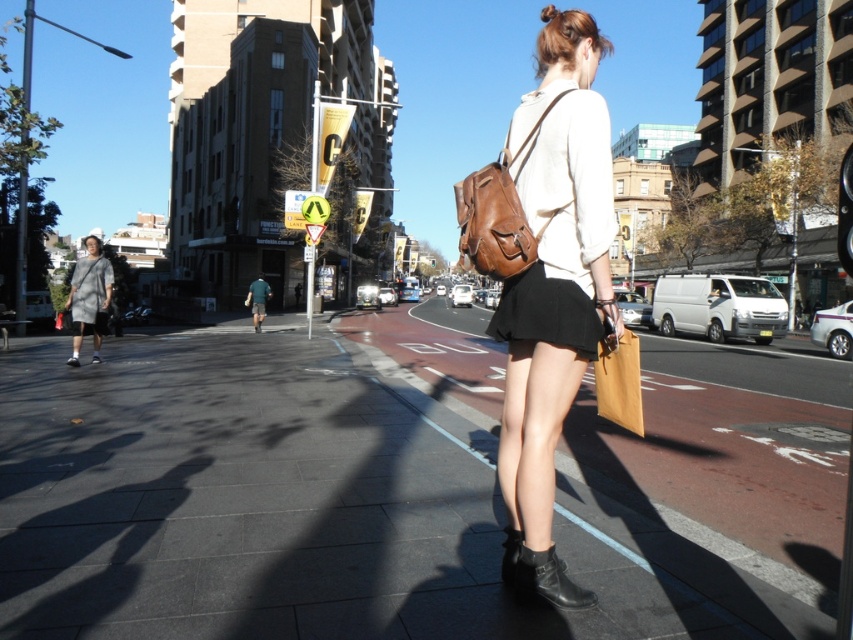
Is point (497, 512) farther from camera compared to point (561, 92)?

Yes, it is.

Is smooth concrete pavement at center to the right of brown leather backpack at upper center from the viewer's perspective?

No, smooth concrete pavement at center is not to the right of brown leather backpack at upper center.

Does point (367, 410) come in front of point (505, 177)?

No, (367, 410) is behind (505, 177).

You are a GUI agent. You are given a task and a screenshot of the screen. Output one action in this format:
    pyautogui.click(x=<x>, y=<y>)
    Task: Click on the smooth concrete pavement at center
    The image size is (853, 640).
    Given the screenshot: What is the action you would take?
    pyautogui.click(x=315, y=509)

Which is above, smooth concrete pavement at center or black leather boot at center?

smooth concrete pavement at center is higher up.

Is smooth concrete pavement at center to the left of black leather boot at center from the viewer's perspective?

Yes, smooth concrete pavement at center is to the left of black leather boot at center.

Does point (12, 408) come behind point (503, 547)?

Yes, point (12, 408) is farther from viewer.

Locate an element on the screen. The image size is (853, 640). smooth concrete pavement at center is located at coordinates (315, 509).

This screenshot has width=853, height=640. What do you see at coordinates (315, 509) in the screenshot? I see `smooth concrete pavement at center` at bounding box center [315, 509].

Between smooth concrete pavement at center and matte brown backpack at center, which one appears on the right side from the viewer's perspective?

Positioned to the right is matte brown backpack at center.

Locate an element on the screen. The height and width of the screenshot is (640, 853). smooth concrete pavement at center is located at coordinates (315, 509).